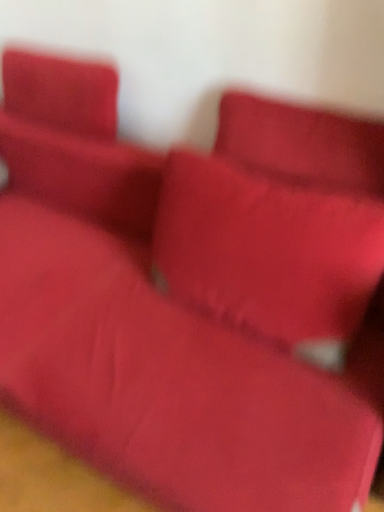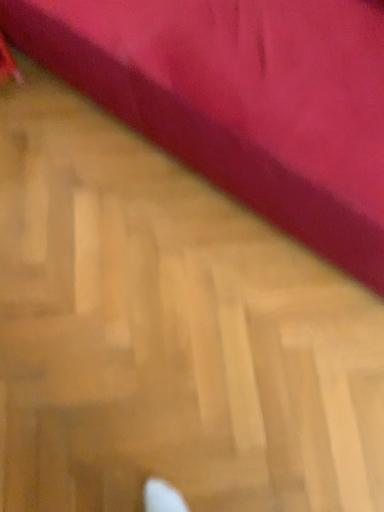
Question: How did the camera likely rotate when shooting the video?

Choices:
 (A) rotated right
 (B) rotated left

Answer: (B)